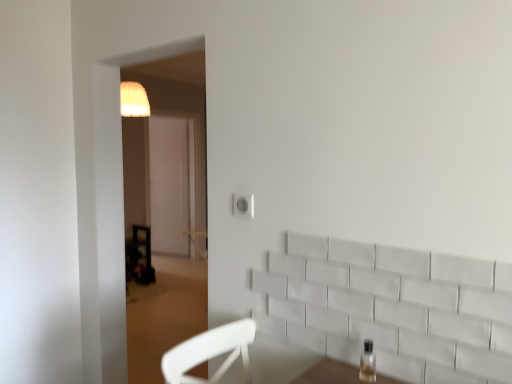
Image resolution: width=512 pixels, height=384 pixels. Identify the location of white matte electric outlet at center. (243, 205).

This screenshot has width=512, height=384. What do you see at coordinates (243, 205) in the screenshot?
I see `white matte electric outlet at center` at bounding box center [243, 205].

What do you see at coordinates (368, 363) in the screenshot?
I see `clear glass bottle at lower right` at bounding box center [368, 363].

Measure the distance between point (369, 341) and camera.

Point (369, 341) is 1.26 meters away from camera.

What are the coordinates of `clear glass bottle at lower right` in the screenshot? It's located at (368, 363).

Where is `white matte electric outlet at center`? This screenshot has width=512, height=384. white matte electric outlet at center is located at coordinates (243, 205).

Which object is positioned more to the left, white matte electric outlet at center or clear glass bottle at lower right?

From the viewer's perspective, white matte electric outlet at center appears more on the left side.

Is white matte electric outlet at center positioned in front of clear glass bottle at lower right?

No, the depth of white matte electric outlet at center is greater than that of clear glass bottle at lower right.

Is point (243, 217) positioned before point (361, 379)?

That is False.

From the image's perspective, which is below, white matte electric outlet at center or clear glass bottle at lower right?

clear glass bottle at lower right is shown below in the image.

From a real-world perspective, who is located lower, white matte electric outlet at center or clear glass bottle at lower right?

In real-world perspective, clear glass bottle at lower right is lower.

Based on the photo, which object is wider, white matte electric outlet at center or clear glass bottle at lower right?

Wider between the two is clear glass bottle at lower right.

In the scene shown: In terms of height, does white matte electric outlet at center look taller or shorter compared to clear glass bottle at lower right?

Clearly, white matte electric outlet at center is shorter compared to clear glass bottle at lower right.

Considering the relative sizes of white matte electric outlet at center and clear glass bottle at lower right in the image provided, is white matte electric outlet at center smaller than clear glass bottle at lower right?

Yes.

Which is correct: white matte electric outlet at center is inside clear glass bottle at lower right, or outside of it?

white matte electric outlet at center is located beyond the bounds of clear glass bottle at lower right.

Are white matte electric outlet at center and clear glass bottle at lower right beside each other?

No, white matte electric outlet at center is not beside clear glass bottle at lower right.

Could you tell me if white matte electric outlet at center is facing clear glass bottle at lower right?

No, white matte electric outlet at center is not facing towards clear glass bottle at lower right.

How many degrees apart are the facing directions of white matte electric outlet at center and clear glass bottle at lower right?

The facing directions of white matte electric outlet at center and clear glass bottle at lower right are 4.1 degrees apart.

Measure the distance from white matte electric outlet at center to clear glass bottle at lower right.

A distance of 23.74 inches exists between white matte electric outlet at center and clear glass bottle at lower right.

The width and height of the screenshot is (512, 384). I want to click on bottle located underneath the white matte electric outlet at center (from a real-world perspective), so click(368, 363).

Considering the positions of objects clear glass bottle at lower right and white matte electric outlet at center in the image provided, who is more to the left, clear glass bottle at lower right or white matte electric outlet at center?

white matte electric outlet at center is more to the left.

Which is in front, clear glass bottle at lower right or white matte electric outlet at center?

Positioned in front is clear glass bottle at lower right.

Which is closer to the camera, (361,355) or (246,195)?

Point (361,355) appears to be closer to the viewer than point (246,195).

From the image's perspective, would you say clear glass bottle at lower right is shown under white matte electric outlet at center?

Correct, clear glass bottle at lower right appears lower than white matte electric outlet at center in the image.

From a real-world perspective, between clear glass bottle at lower right and white matte electric outlet at center, who is vertically higher?

In real-world perspective, white matte electric outlet at center is above.

Does clear glass bottle at lower right have a lesser width compared to white matte electric outlet at center?

In fact, clear glass bottle at lower right might be wider than white matte electric outlet at center.

Does clear glass bottle at lower right have a greater height compared to white matte electric outlet at center?

Correct, clear glass bottle at lower right is much taller as white matte electric outlet at center.

In terms of size, does clear glass bottle at lower right appear bigger or smaller than white matte electric outlet at center?

In the image, clear glass bottle at lower right appears to be larger than white matte electric outlet at center.

Is clear glass bottle at lower right not within white matte electric outlet at center?

clear glass bottle at lower right is positioned outside white matte electric outlet at center.

Looking at this image, is clear glass bottle at lower right in contact with white matte electric outlet at center?

No, clear glass bottle at lower right is not next to white matte electric outlet at center.

Is clear glass bottle at lower right positioned with its back to white matte electric outlet at center?

clear glass bottle at lower right does not have its back to white matte electric outlet at center.

How many degrees apart are the facing directions of clear glass bottle at lower right and white matte electric outlet at center?

They differ by 4.1 degrees in their facing directions.

How distant is clear glass bottle at lower right from white matte electric outlet at center?

clear glass bottle at lower right is 23.74 inches from white matte electric outlet at center.

At what (x,y) coordinates should I click in order to perform the action: click on bottle below the white matte electric outlet at center (from the image's perspective). Please return your answer as a coordinate pair (x, y). Image resolution: width=512 pixels, height=384 pixels. Looking at the image, I should click on (368, 363).

At what (x,y) coordinates should I click in order to perform the action: click on electric outlet above the clear glass bottle at lower right (from the image's perspective). Please return your answer as a coordinate pair (x, y). The width and height of the screenshot is (512, 384). Looking at the image, I should click on (243, 205).

The height and width of the screenshot is (384, 512). Identify the location of bottle on the right of white matte electric outlet at center. (368, 363).